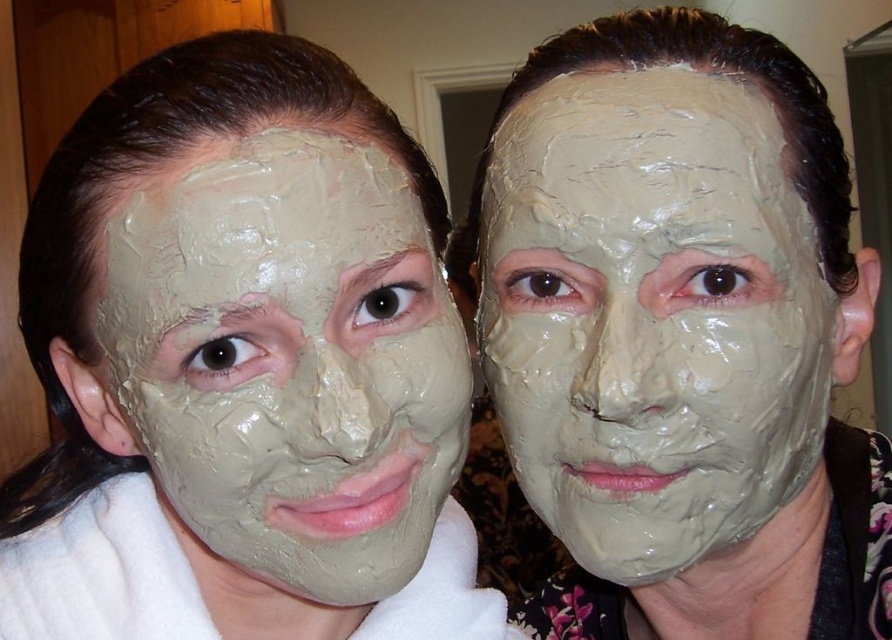
Question: Which object appears farthest from the camera in this image?

Choices:
 (A) matte clay mask at center
 (B) matte clay mask at left

Answer: (A)

Question: Can you confirm if matte clay mask at center is smaller than matte clay mask at left?

Choices:
 (A) no
 (B) yes

Answer: (B)

Question: Is matte clay mask at center above matte clay mask at left?

Choices:
 (A) no
 (B) yes

Answer: (B)

Question: Which object appears closest to the camera in this image?

Choices:
 (A) matte clay mask at left
 (B) matte clay mask at center

Answer: (A)

Question: Among these objects, which one is farthest from the camera?

Choices:
 (A) matte clay mask at left
 (B) matte clay mask at center

Answer: (B)

Question: Is matte clay mask at center thinner than matte clay mask at left?

Choices:
 (A) yes
 (B) no

Answer: (B)